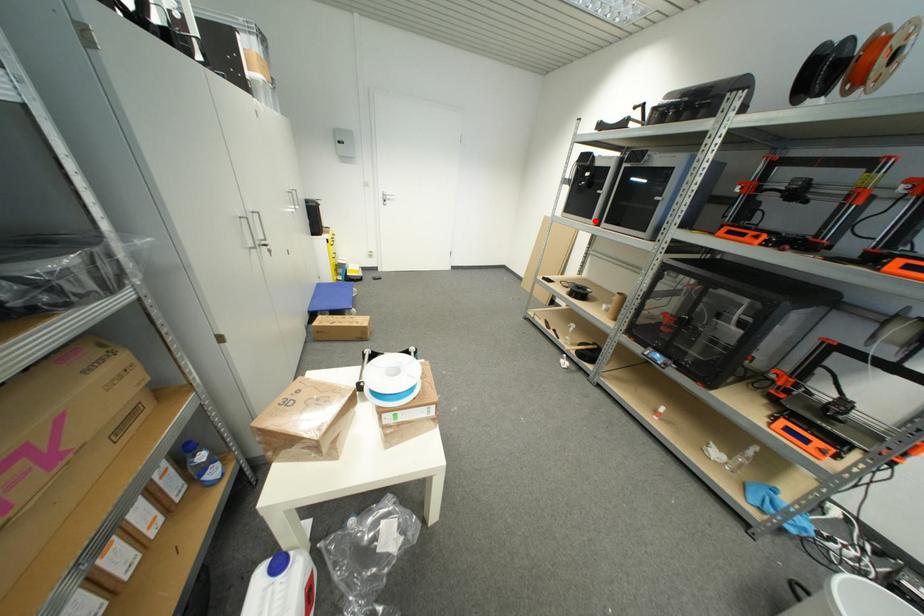
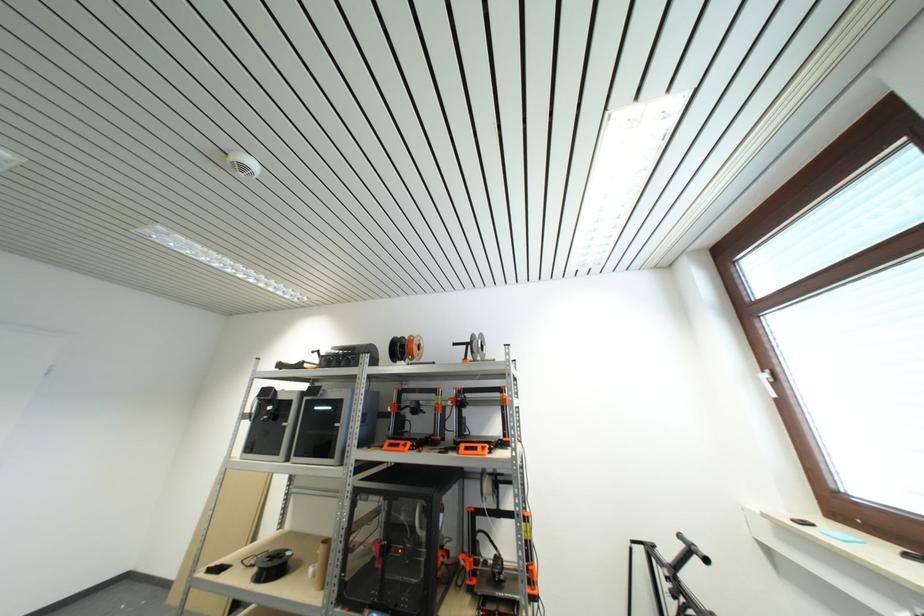
Where in the second image is the point corresponding to the highlighted location from the first image?

(283, 456)